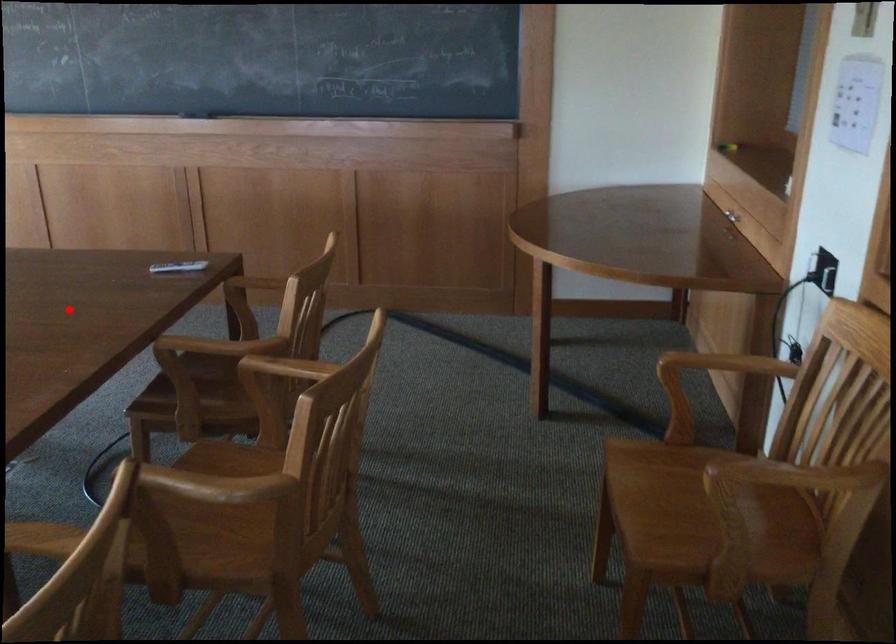
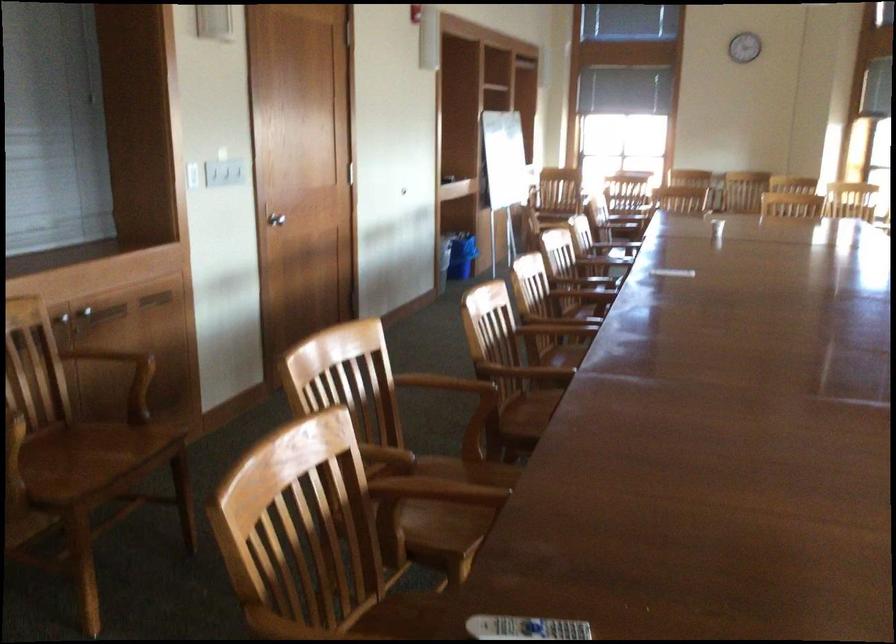
Question: I am providing you with two images of the same scene from different viewpoints. Image1 has a red point marked. In image2, the corresponding 3D location appears at what relative position? Reply with the corresponding letter.

Choices:
 (A) Closer
 (B) Farther

Answer: (A)